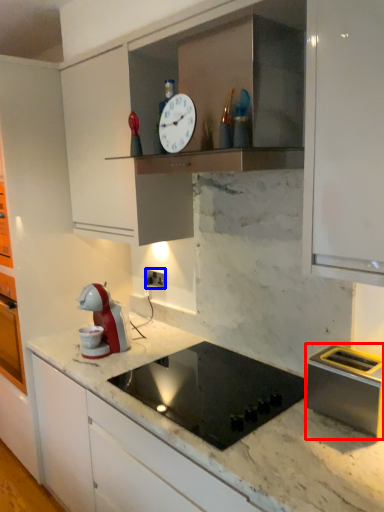
Question: Which object appears closest to the camera in this image, kitchen appliance (highlighted by a red box) or electric outlet (highlighted by a blue box)?

Choices:
 (A) kitchen appliance
 (B) electric outlet

Answer: (A)